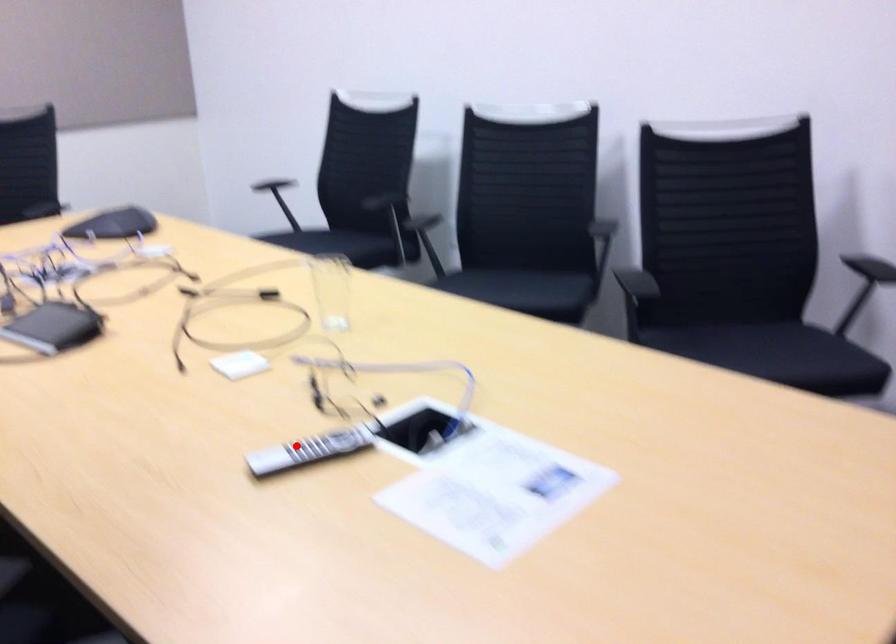
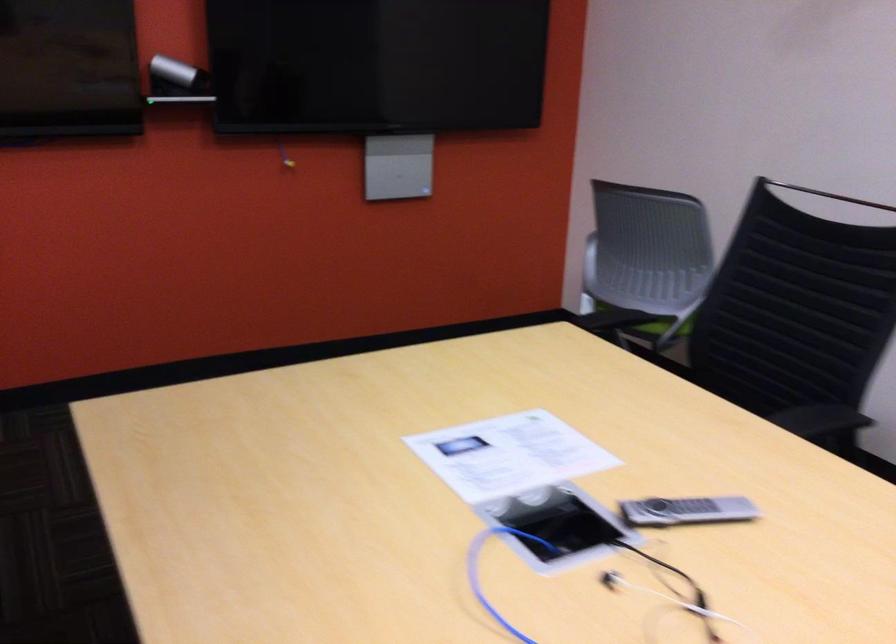
Locate, in the second image, the point that corresponds to the highlighted location in the first image.

(686, 511)